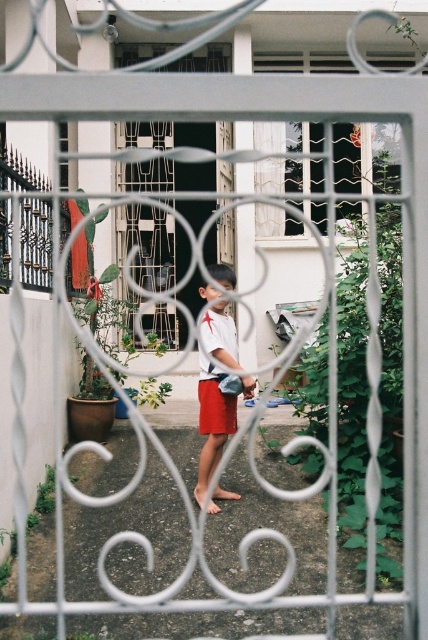
You are a fashion designer observing a child wearing the white matte shirt at center and red cotton shorts at center. Which clothing item is covering the other?

The white matte shirt at center is positioned over the red cotton shorts at center, so the shirt is covering the shorts.

You are a fashion designer observing a child wearing the white matte shirt at center and red cotton shorts at center. Which clothing item is closer to the camera?

The white matte shirt at center is closer to the camera because it is in front of the red cotton shorts at center.